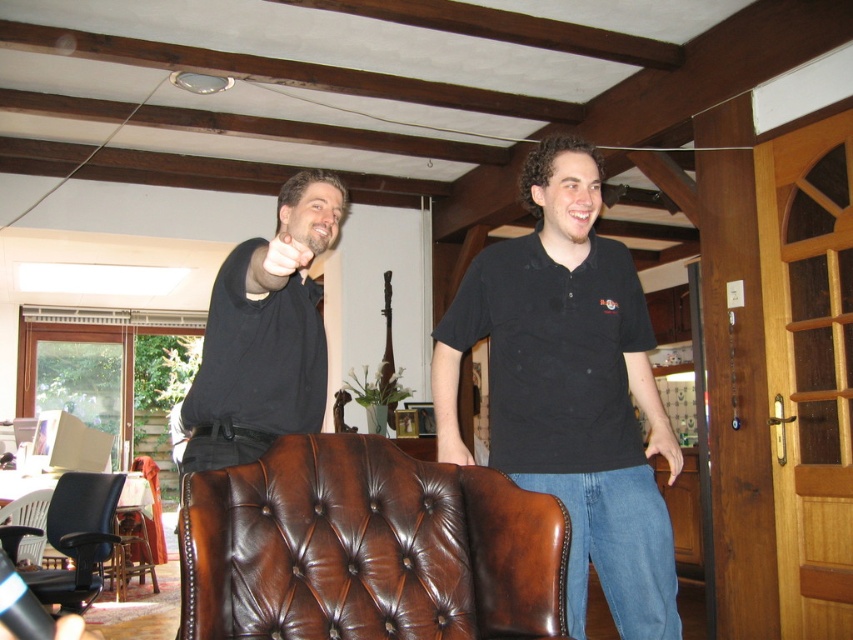
You are a photographer setting up a shoot in this room. You need to position a light source so that it illuminates both the matte black shirt at center and the black leather shirt at center equally. Given their height difference, where should you place the light source relative to them?

The matte black shirt at center is much taller than the black leather shirt at center. To ensure both receive equal illumination, the light source should be positioned higher above them so that the light can reach both the taller and shorter shirts uniformly.

You are standing in the room and want to hand a gift to the person wearing the matte black shirt at center and the black leather shirt at center. Which one is positioned more to your right side?

The matte black shirt at center is positioned to the right of the black leather shirt at center, so the matte black shirt at center is more to your right side.